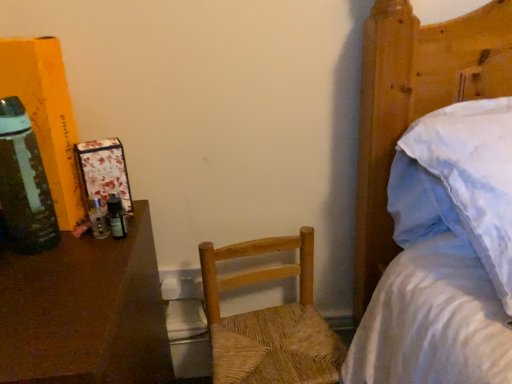
Question: Can you confirm if brown polished wood desk at left is positioned to the right of woven wood chair at center?

Choices:
 (A) yes
 (B) no

Answer: (B)

Question: Are brown polished wood desk at left and woven wood chair at center far apart?

Choices:
 (A) yes
 (B) no

Answer: (B)

Question: Does brown polished wood desk at left turn towards woven wood chair at center?

Choices:
 (A) yes
 (B) no

Answer: (B)

Question: From the image's perspective, does brown polished wood desk at left appear higher than woven wood chair at center?

Choices:
 (A) yes
 (B) no

Answer: (B)

Question: Considering the relative sizes of brown polished wood desk at left and woven wood chair at center in the image provided, is brown polished wood desk at left taller than woven wood chair at center?

Choices:
 (A) yes
 (B) no

Answer: (A)

Question: In the image, is white cotton bed at upper right on the left side or the right side of green glass bottle at left?

Choices:
 (A) left
 (B) right

Answer: (B)

Question: From a real-world perspective, relative to green glass bottle at left, is white cotton bed at upper right vertically above or below?

Choices:
 (A) above
 (B) below

Answer: (B)

Question: Considering the positions of point (409, 29) and point (27, 114), is point (409, 29) closer or farther from the camera than point (27, 114)?

Choices:
 (A) closer
 (B) farther

Answer: (B)

Question: From their relative heights in the image, would you say white cotton bed at upper right is taller or shorter than green glass bottle at left?

Choices:
 (A) tall
 (B) short

Answer: (A)

Question: Does point (126, 269) appear closer or farther from the camera than point (283, 236)?

Choices:
 (A) closer
 (B) farther

Answer: (A)

Question: In terms of height, does brown polished wood desk at left look taller or shorter compared to woven wood chair at center?

Choices:
 (A) tall
 (B) short

Answer: (A)

Question: Is brown polished wood desk at left wider or thinner than woven wood chair at center?

Choices:
 (A) wide
 (B) thin

Answer: (A)

Question: Is brown polished wood desk at left inside the boundaries of woven wood chair at center, or outside?

Choices:
 (A) outside
 (B) inside

Answer: (A)

Question: Is woven wood chair at center wider or thinner than white cotton bed at upper right?

Choices:
 (A) wide
 (B) thin

Answer: (B)

Question: From the image's perspective, is woven wood chair at center positioned above or below white cotton bed at upper right?

Choices:
 (A) above
 (B) below

Answer: (B)